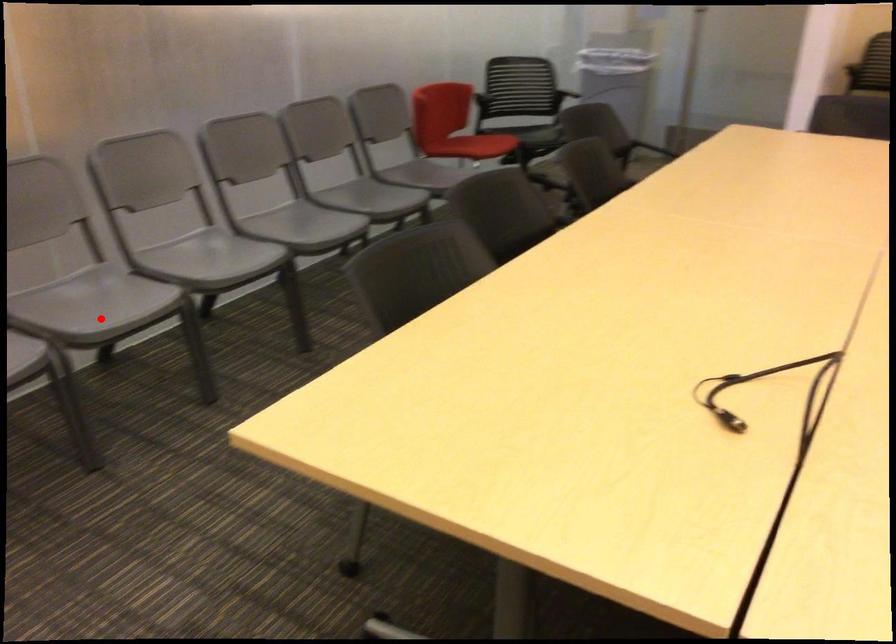
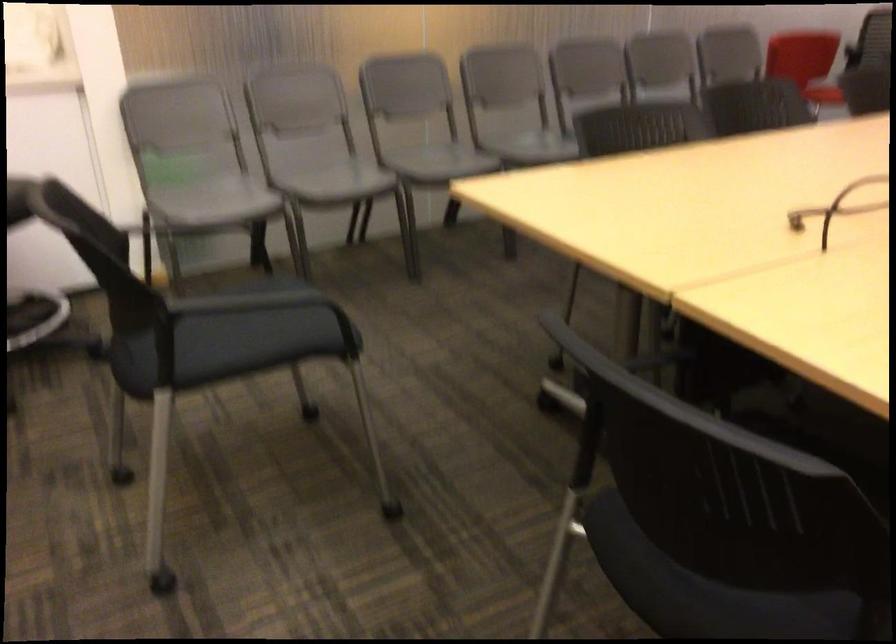
Question: I am providing you with two images of the same scene from different viewpoints. A red point is shown in image1. For the corresponding object point in image2, is it positioned nearer or farther from the camera?

Choices:
 (A) Nearer
 (B) Farther

Answer: (B)